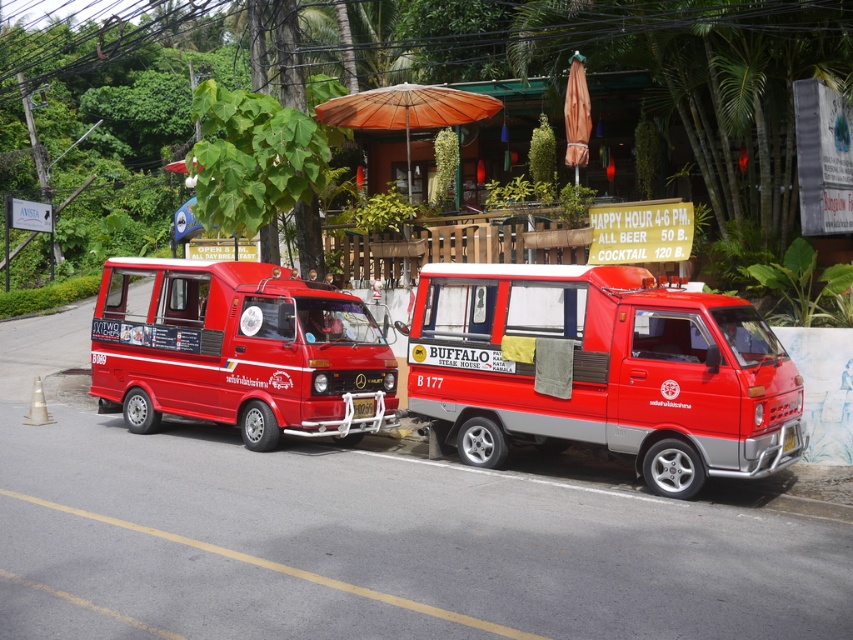
You are a customer standing at the street and want to choose an umbrella to stay dry under. Which one is wider between the orange woven umbrella at center and the orange fabric umbrella at upper center?

The orange woven umbrella at center is wider than the orange fabric umbrella at upper center according to the description.

Please look at the image. There is a point at coordinate (405, 109). What object is this point located on?

The point at coordinate (405, 109) is located on the orange woven umbrella at center.